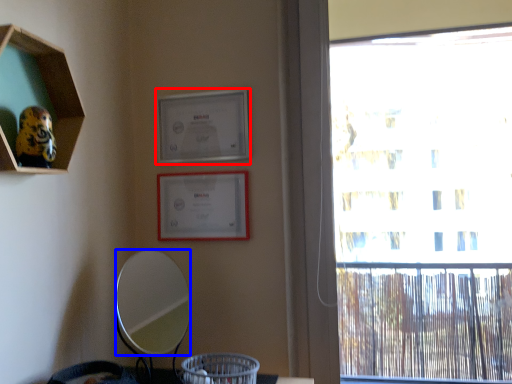
Question: Among these objects, which one is farthest to the camera, picture frame (highlighted by a red box) or mirror (highlighted by a blue box)?

Choices:
 (A) picture frame
 (B) mirror

Answer: (A)